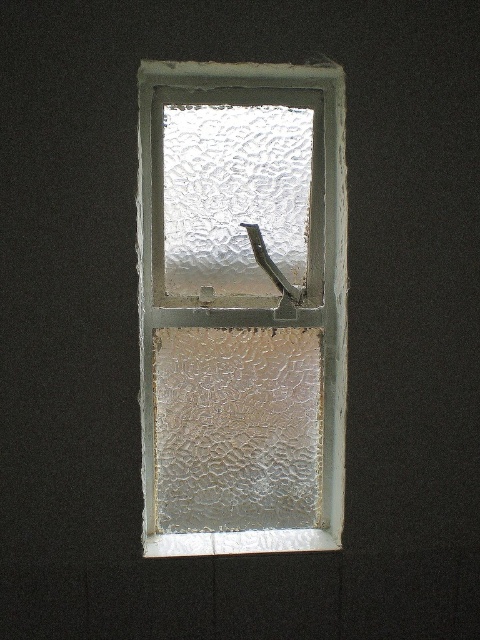
Question: Which point is farther to the camera?

Choices:
 (A) (248, 262)
 (B) (274, 522)

Answer: (A)

Question: Which of the following is the closest to the observer?

Choices:
 (A) white textured frame at center
 (B) frosted glass at center

Answer: (A)

Question: In this image, where is white textured frame at center located relative to frosted glass at center?

Choices:
 (A) right
 (B) left

Answer: (A)

Question: Among these points, which one is nearest to the camera?

Choices:
 (A) (159, 289)
 (B) (299, 138)

Answer: (A)

Question: Can you confirm if white textured frame at center is positioned to the left of frosted glass at center?

Choices:
 (A) yes
 (B) no

Answer: (B)

Question: Considering the relative positions of white textured frame at center and frosted glass at center in the image provided, where is white textured frame at center located with respect to frosted glass at center?

Choices:
 (A) above
 (B) below

Answer: (B)